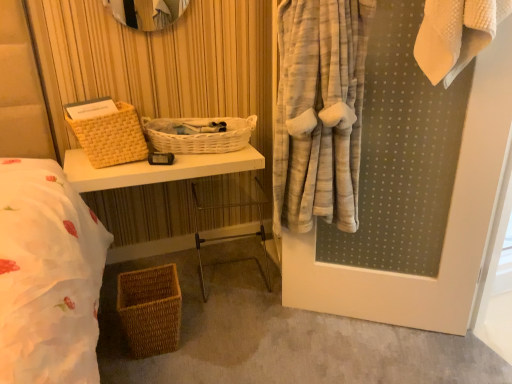
Question: From the image's perspective, is white wicker basket at center, the third basket positioned from the bottom, located above woven wicker basket at left, which is the second basket in bottom-to-top order?

Choices:
 (A) no
 (B) yes

Answer: (B)

Question: Is white wicker basket at center, the third basket positioned from the bottom, located outside woven wicker basket at left, which is the second basket in bottom-to-top order?

Choices:
 (A) yes
 (B) no

Answer: (A)

Question: Can you confirm if white wicker basket at center, the third basket positioned from the bottom, is wider than woven wicker basket at left, which ranks as the second basket in top-to-bottom order?

Choices:
 (A) yes
 (B) no

Answer: (A)

Question: Could woven wicker basket at left, which ranks as the second basket in top-to-bottom order, be considered to be inside white wicker basket at center, which ranks as the first basket in top-to-bottom order?

Choices:
 (A) no
 (B) yes

Answer: (A)

Question: Is white wicker basket at center, which ranks as the first basket in top-to-bottom order, looking in the opposite direction of woven wicker basket at left, which is the second basket in bottom-to-top order?

Choices:
 (A) no
 (B) yes

Answer: (A)

Question: Is point (96, 183) positioned closer to the camera than point (225, 142)?

Choices:
 (A) closer
 (B) farther

Answer: (A)

Question: Looking at their shapes, would you say woven wood table at center is wider or thinner than white wicker basket at center, which ranks as the first basket in top-to-bottom order?

Choices:
 (A) wide
 (B) thin

Answer: (A)

Question: Would you say woven wood table at center is inside or outside white wicker basket at center, the third basket positioned from the bottom?

Choices:
 (A) outside
 (B) inside

Answer: (A)

Question: In the image, is woven wood table at center positioned in front of or behind white wicker basket at center, which ranks as the first basket in top-to-bottom order?

Choices:
 (A) front
 (B) behind

Answer: (A)

Question: Is white wicker basket at center, which ranks as the first basket in top-to-bottom order, in front of or behind woven brown basket at lower left, marked as the first basket in a bottom-to-top arrangement, in the image?

Choices:
 (A) behind
 (B) front

Answer: (A)

Question: Considering the relative positions of white wicker basket at center, the third basket positioned from the bottom, and woven brown basket at lower left, marked as the first basket in a bottom-to-top arrangement, in the image provided, is white wicker basket at center, the third basket positioned from the bottom, to the left or to the right of woven brown basket at lower left, marked as the first basket in a bottom-to-top arrangement,?

Choices:
 (A) left
 (B) right

Answer: (B)

Question: From the image's perspective, is white wicker basket at center, the third basket positioned from the bottom, above or below woven brown basket at lower left, marked as the first basket in a bottom-to-top arrangement?

Choices:
 (A) above
 (B) below

Answer: (A)

Question: Considering the positions of white wicker basket at center, the third basket positioned from the bottom, and woven brown basket at lower left, which is counted as the third basket, starting from the top, in the image, is white wicker basket at center, the third basket positioned from the bottom, wider or thinner than woven brown basket at lower left, which is counted as the third basket, starting from the top,?

Choices:
 (A) wide
 (B) thin

Answer: (A)

Question: Is woven wicker basket at left, which ranks as the second basket in top-to-bottom order, inside the boundaries of woven wood table at center, or outside?

Choices:
 (A) outside
 (B) inside

Answer: (A)

Question: Is point tap(126, 132) closer or farther from the camera than point tap(244, 160)?

Choices:
 (A) closer
 (B) farther

Answer: (A)